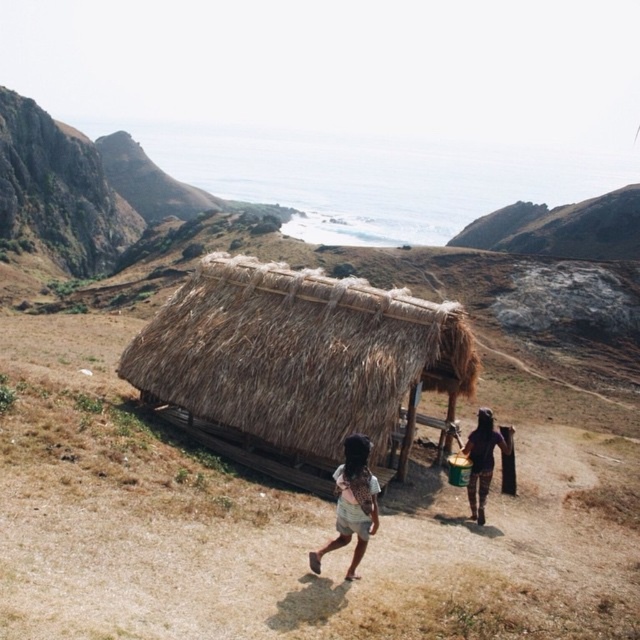
Question: Is light brown fabric skirt at lower center to the right of dark brown leather boots at lower right from the viewer's perspective?

Choices:
 (A) no
 (B) yes

Answer: (A)

Question: Can you confirm if brown thatch hut at center is positioned to the right of dark brown leather boots at lower right?

Choices:
 (A) no
 (B) yes

Answer: (A)

Question: Which point appears closest to the camera in this image?

Choices:
 (A) (355, 502)
 (B) (484, 440)
 (C) (138, 346)

Answer: (A)

Question: Is brown thatch hut at center in front of dark brown leather boots at lower right?

Choices:
 (A) yes
 (B) no

Answer: (A)

Question: Estimate the real-world distances between objects in this image. Which object is farther from the brown thatch hut at center?

Choices:
 (A) light brown fabric skirt at lower center
 (B) dark brown leather boots at lower right

Answer: (A)

Question: Based on their relative distances, which object is nearer to the brown thatch hut at center?

Choices:
 (A) light brown fabric skirt at lower center
 (B) dark brown leather boots at lower right

Answer: (B)